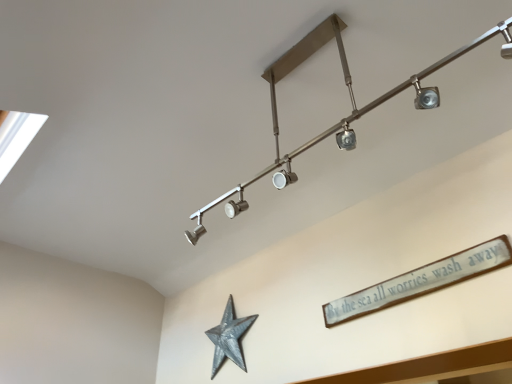
Question: Does white wooden sign at upper right have a greater height compared to galvanized metal star at lower center?

Choices:
 (A) yes
 (B) no

Answer: (B)

Question: From a real-world perspective, does white wooden sign at upper right sit lower than galvanized metal star at lower center?

Choices:
 (A) no
 (B) yes

Answer: (B)

Question: From the image's perspective, is white wooden sign at upper right below galvanized metal star at lower center?

Choices:
 (A) yes
 (B) no

Answer: (B)

Question: Is galvanized metal star at lower center a part of white wooden sign at upper right?

Choices:
 (A) yes
 (B) no

Answer: (B)

Question: From the image's perspective, does white wooden sign at upper right appear higher than galvanized metal star at lower center?

Choices:
 (A) yes
 (B) no

Answer: (A)

Question: Is white wooden sign at upper right thinner than galvanized metal star at lower center?

Choices:
 (A) no
 (B) yes

Answer: (B)

Question: From a real-world perspective, is satin nickel track light at upper center physically below white wooden sign at upper right?

Choices:
 (A) yes
 (B) no

Answer: (B)

Question: Is white wooden sign at upper right at the back of satin nickel track light at upper center?

Choices:
 (A) no
 (B) yes

Answer: (B)

Question: From a real-world perspective, is satin nickel track light at upper center physically above white wooden sign at upper right?

Choices:
 (A) no
 (B) yes

Answer: (B)

Question: Considering the relative positions of satin nickel track light at upper center and white wooden sign at upper right in the image provided, is satin nickel track light at upper center to the right of white wooden sign at upper right from the viewer's perspective?

Choices:
 (A) no
 (B) yes

Answer: (A)

Question: Considering the relative sizes of satin nickel track light at upper center and white wooden sign at upper right in the image provided, is satin nickel track light at upper center shorter than white wooden sign at upper right?

Choices:
 (A) yes
 (B) no

Answer: (B)

Question: Is satin nickel track light at upper center oriented towards white wooden sign at upper right?

Choices:
 (A) yes
 (B) no

Answer: (B)

Question: Is galvanized metal star at lower center positioned in front of satin nickel track light at upper center?

Choices:
 (A) no
 (B) yes

Answer: (A)